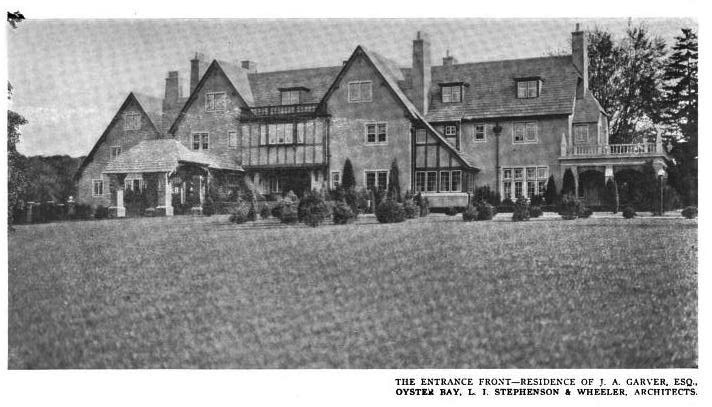
Locate an element on the screen. front door is located at coordinates (191, 189).